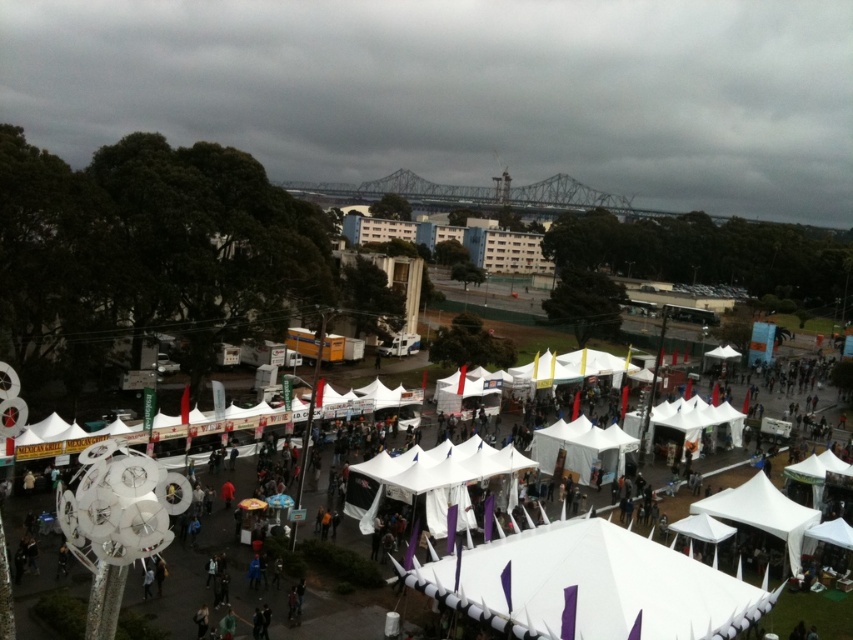
Question: Can you confirm if white fabric canopy at center is bigger than white fabric tent at lower right?

Choices:
 (A) yes
 (B) no

Answer: (A)

Question: Can you confirm if white fabric canopy at center is thinner than white fabric tent at lower right?

Choices:
 (A) yes
 (B) no

Answer: (B)

Question: Which point is closer to the camera taking this photo?

Choices:
 (A) (654, 627)
 (B) (793, 570)

Answer: (A)

Question: Is white fabric canopy at center further to the viewer compared to white fabric tent at lower right?

Choices:
 (A) yes
 (B) no

Answer: (B)